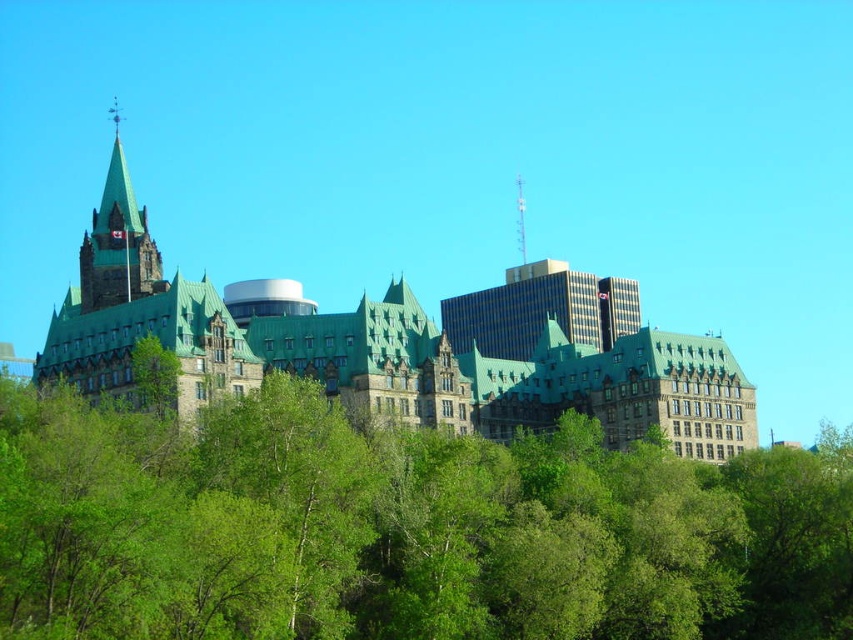
You are a tourist visiting this historic site and want to take a photo that includes both the green shingled castle at center and the dark brown stone tower at upper left. Given their sizes, which one should you frame closer to the center of your photo to ensure both are visible?

Since the green shingled castle at center is larger than the dark brown stone tower at upper left, you should frame the green shingled castle at center closer to the center of your photo to ensure both are visible.

You are a drone operator tasked with capturing aerial footage of the green shingled castle at center and the dark brown stone tower at upper left. The minimum distance required between the drone and any structure for safe flight is 50 feet. Can you safely fly the drone between them?

The green shingled castle at center is 75.38 feet from the dark brown stone tower at upper left. Since the required minimum distance is 50 feet, the drone can safely fly between them as the distance is sufficient.